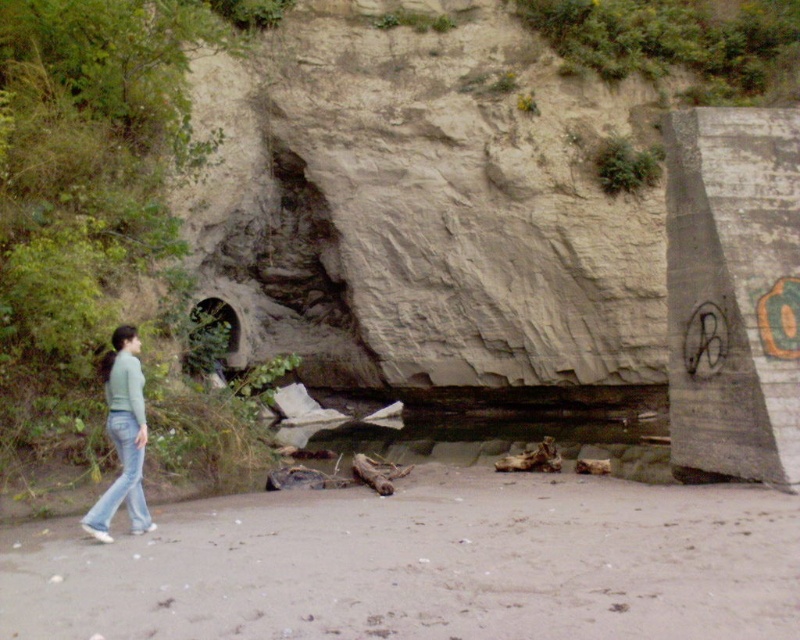
Question: Can you confirm if brown sand at lower center is bigger than blue denim jeans at lower left?

Choices:
 (A) yes
 (B) no

Answer: (B)

Question: Which of the following is the closest to the observer?

Choices:
 (A) blue denim jeans at lower left
 (B) brown sand at lower center

Answer: (B)

Question: Does brown sand at lower center appear over blue denim jeans at lower left?

Choices:
 (A) no
 (B) yes

Answer: (A)

Question: Is brown sand at lower center below blue denim jeans at lower left?

Choices:
 (A) yes
 (B) no

Answer: (A)

Question: Which point appears farthest from the camera in this image?

Choices:
 (A) pos(132,508)
 (B) pos(454,540)

Answer: (A)